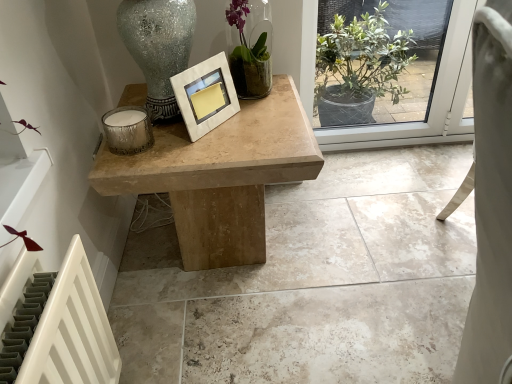
Question: From their relative heights in the image, would you say natural wood table at center is taller or shorter than natural stone table at center?

Choices:
 (A) short
 (B) tall

Answer: (B)

Question: From a real-world perspective, is natural wood table at center positioned above or below natural stone table at center?

Choices:
 (A) below
 (B) above

Answer: (B)

Question: Considering the real-world distances, which object is closest to the white marble picture frame at center?

Choices:
 (A) natural stone table at center
 (B) green glass vase at upper center
 (C) natural wood table at center
 (D) metallic textured candle at left

Answer: (D)

Question: Based on their relative distances, which object is nearer to the natural wood table at center?

Choices:
 (A) metallic textured candle at left
 (B) natural stone table at center
 (C) green glass vase at upper center
 (D) white marble picture frame at center

Answer: (D)